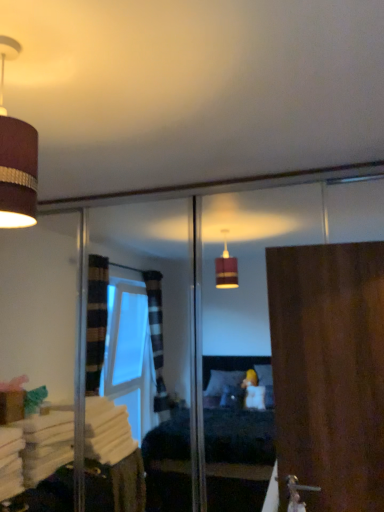
Question: Based on their positions, is wooden door at right located to the left or right of matte brown lampshade at upper left?

Choices:
 (A) right
 (B) left

Answer: (A)

Question: From a real-world perspective, is wooden door at right positioned above or below matte brown lampshade at upper left?

Choices:
 (A) above
 (B) below

Answer: (B)

Question: Considering the positions of wooden door at right and matte brown lampshade at upper left in the image, is wooden door at right bigger or smaller than matte brown lampshade at upper left?

Choices:
 (A) big
 (B) small

Answer: (A)

Question: From the image's perspective, is matte brown lampshade at upper left positioned above or below wooden door at right?

Choices:
 (A) above
 (B) below

Answer: (A)

Question: Considering their positions, is matte brown lampshade at upper left located in front of or behind wooden door at right?

Choices:
 (A) behind
 (B) front

Answer: (B)

Question: Does point (6, 226) appear closer or farther from the camera than point (354, 380)?

Choices:
 (A) farther
 (B) closer

Answer: (B)

Question: Do you think matte brown lampshade at upper left is within wooden door at right, or outside of it?

Choices:
 (A) outside
 (B) inside

Answer: (A)